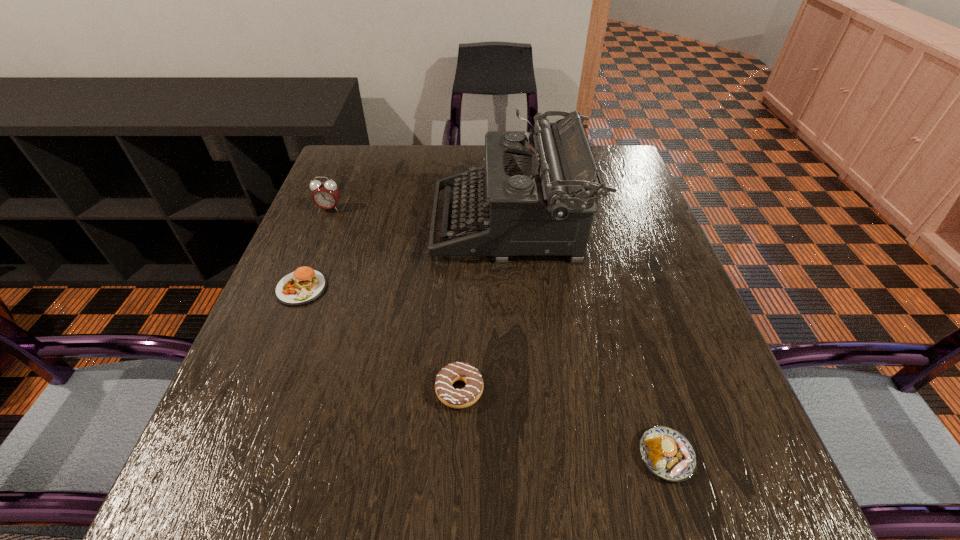
At what (x,y) coordinates should I click in order to perform the action: click on vacant point located on the right of the doughnut. Please return your answer as a coordinate pair (x, y). The height and width of the screenshot is (540, 960). Looking at the image, I should click on (666, 390).

Find the location of a particular element. The image size is (960, 540). vacant space situated 0.200m on the left of the nearest object is located at coordinates (510, 455).

Identify the location of object located in the far edge section of the desktop. The width and height of the screenshot is (960, 540). (539, 193).

Where is `object at the near edge`? object at the near edge is located at coordinates (667, 453).

The height and width of the screenshot is (540, 960). Identify the location of alarm clock present at the left edge. (326, 194).

Where is `patty present at the left edge`? The width and height of the screenshot is (960, 540). patty present at the left edge is located at coordinates (304, 285).

Where is `object that is at the right edge`? The image size is (960, 540). object that is at the right edge is located at coordinates (667, 453).

You are a GUI agent. You are given a task and a screenshot of the screen. Output one action in this format:
    pyautogui.click(x=<x>, y=<y>)
    Task: Click on the object present at the near right corner
    The image size is (960, 540).
    Given the screenshot: What is the action you would take?
    pyautogui.click(x=667, y=453)

At what (x,y) coordinates should I click in order to perform the action: click on vacant space at the near edge of the desktop. Please return your answer as a coordinate pair (x, y). This screenshot has height=540, width=960. Looking at the image, I should click on (630, 525).

In the image, there is a desktop. In order to click on free space at the left edge in this screenshot , I will do `click(346, 302)`.